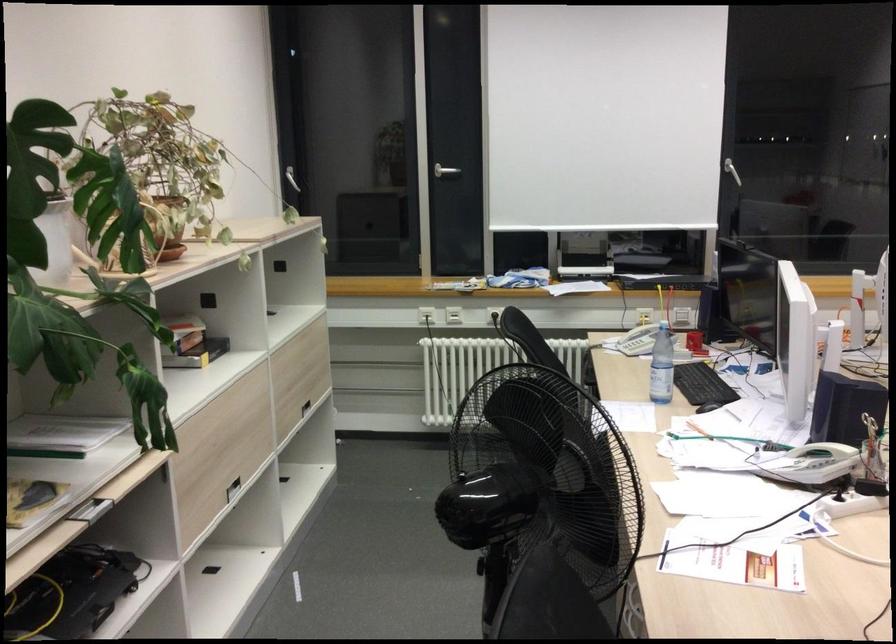
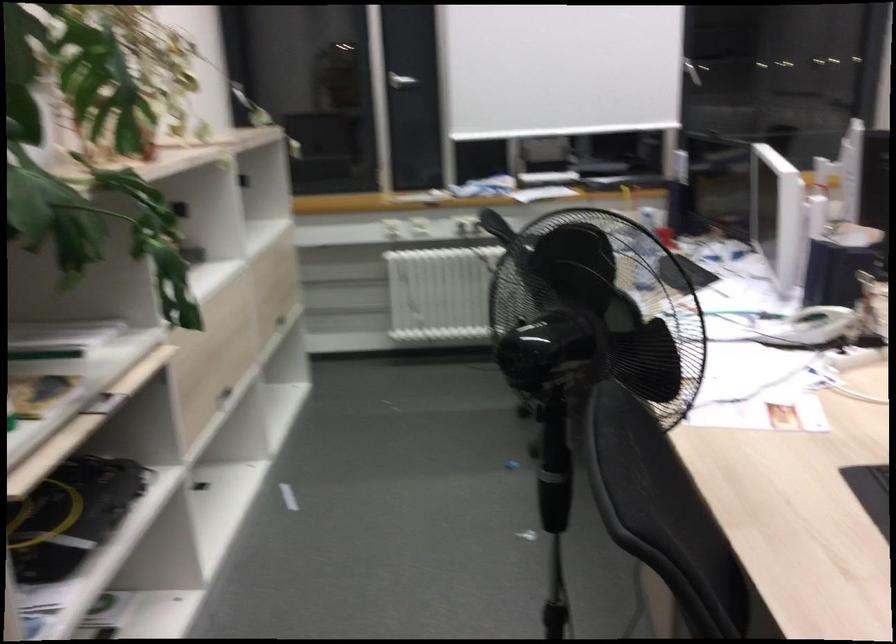
Question: Which direction would the cameraman need to move to produce the second image? Reply with the corresponding letter.

Choices:
 (A) Left
 (B) Right
 (C) Forward
 (D) Backward

Answer: (A)